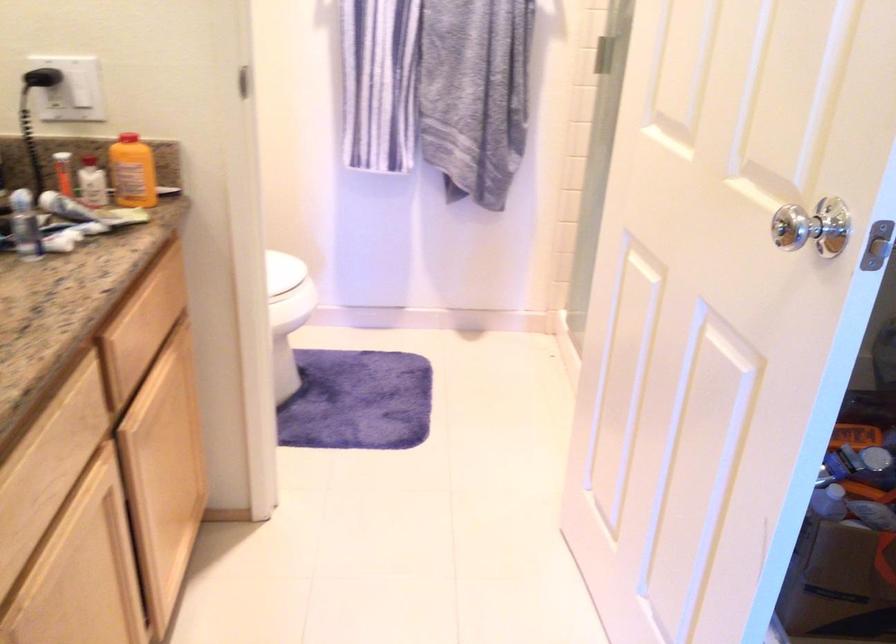
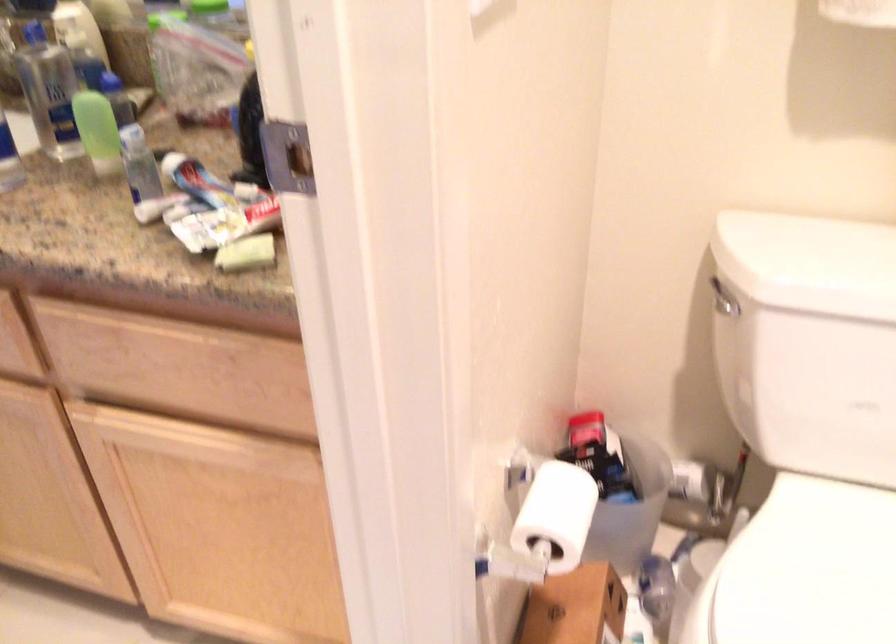
Find the pixel in the second image that matches point 217,275 in the first image.

(556, 515)